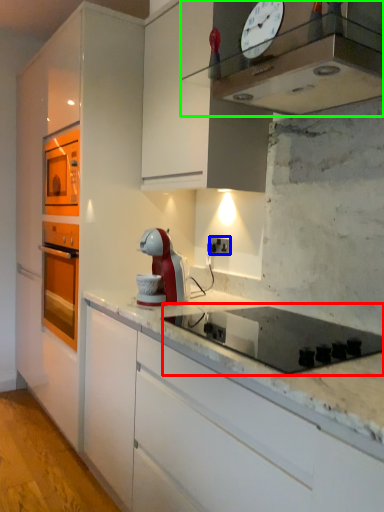
Question: Which is nearer to the gas stove (highlighted by a red box)? electric outlet (highlighted by a blue box) or home appliance (highlighted by a green box).

Choices:
 (A) electric outlet
 (B) home appliance

Answer: (B)